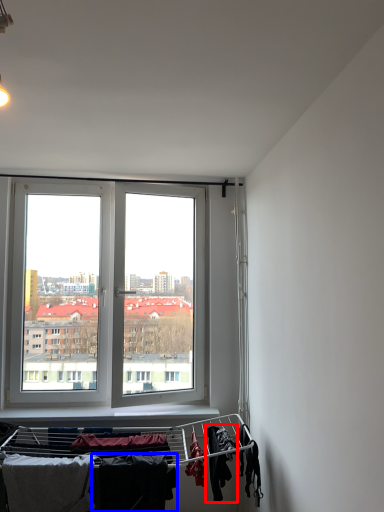
Question: Which object is further to the camera taking this photo, clothing (highlighted by a red box) or clothing (highlighted by a blue box)?

Choices:
 (A) clothing
 (B) clothing

Answer: (A)